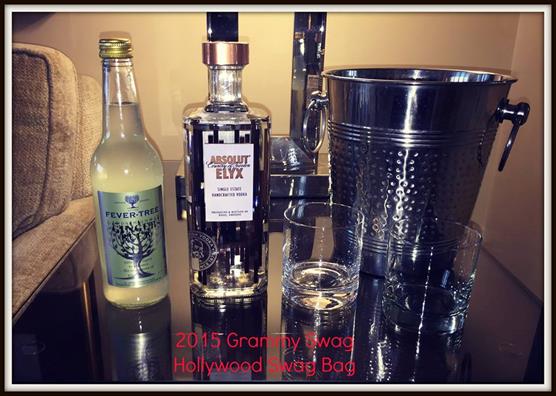
Where is `ice bucket`? The height and width of the screenshot is (396, 556). ice bucket is located at coordinates (406, 143).